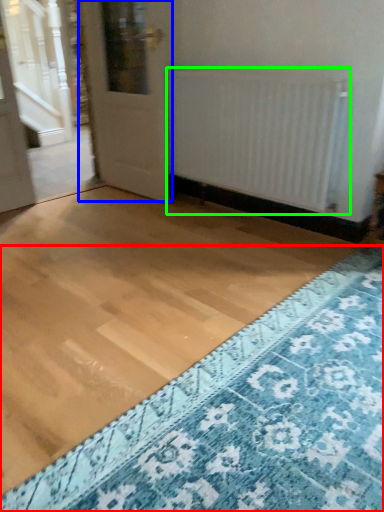
Question: Which object is positioned farthest from doormat (highlighted by a red box)? Select from door (highlighted by a blue box) and radiator (highlighted by a green box).

Choices:
 (A) door
 (B) radiator

Answer: (A)